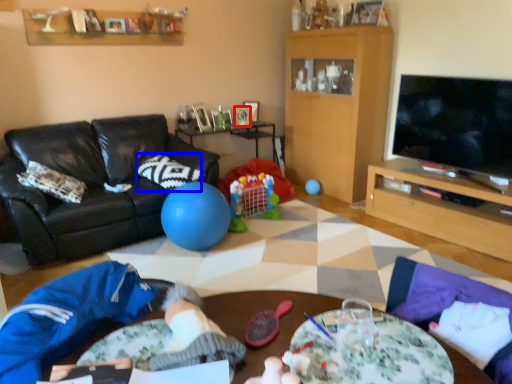
Question: Among these objects, which one is farthest to the camera, picture frame (highlighted by a red box) or pillow (highlighted by a blue box)?

Choices:
 (A) picture frame
 (B) pillow

Answer: (A)